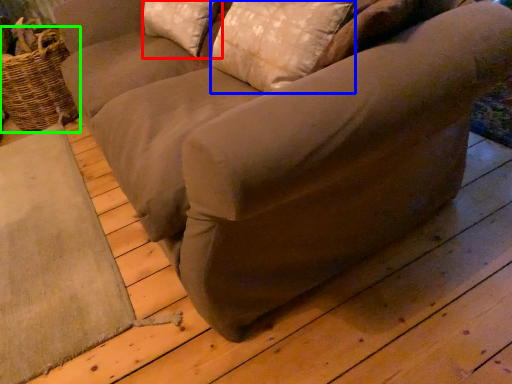
Question: Considering the real-world distances, which object is farthest from pillow (highlighted by a red box)? pillow (highlighted by a blue box) or basket (highlighted by a green box)?

Choices:
 (A) pillow
 (B) basket

Answer: (B)